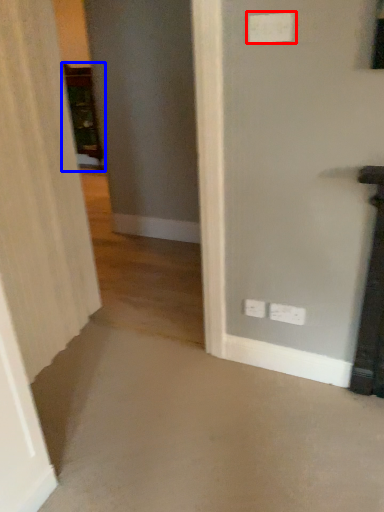
Question: Which point is further to the camera, electric outlet (highlighted by a red box) or furniture (highlighted by a blue box)?

Choices:
 (A) electric outlet
 (B) furniture

Answer: (B)